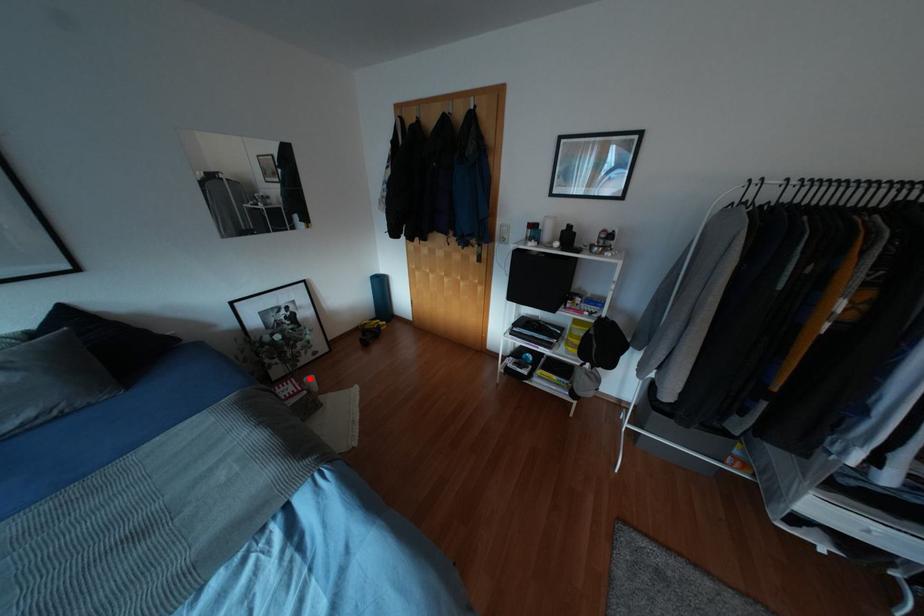
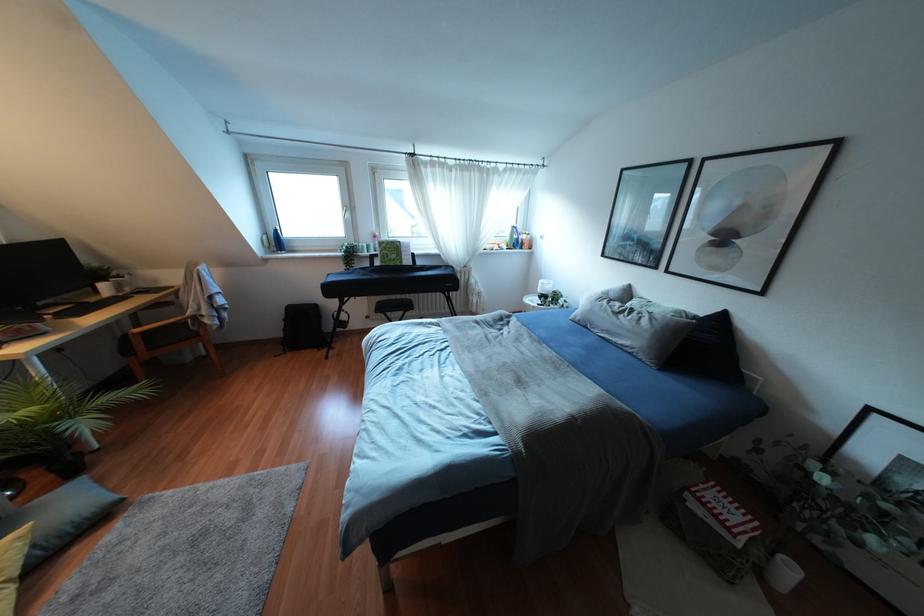
In the second image, find the point that corresponds to the highlighted location in the first image.

(791, 570)